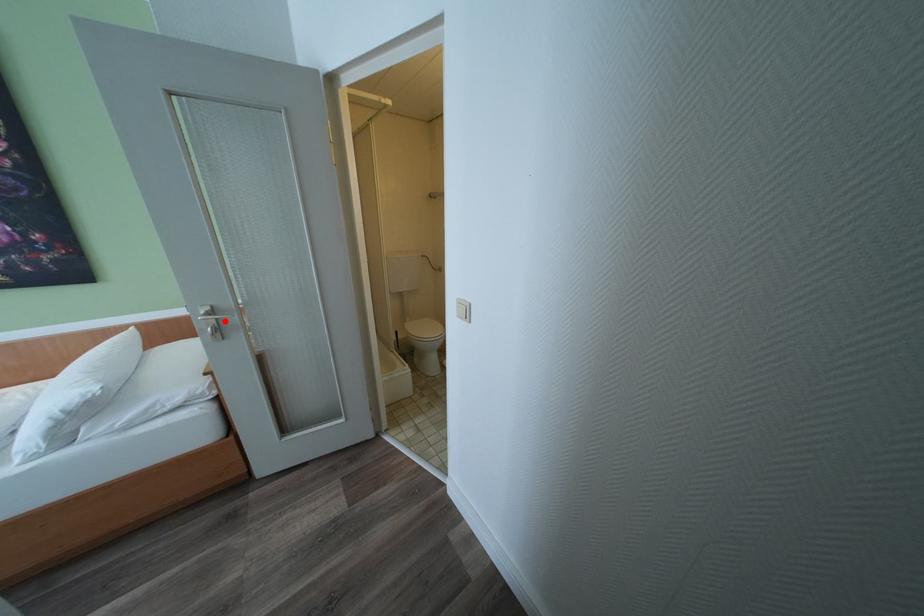
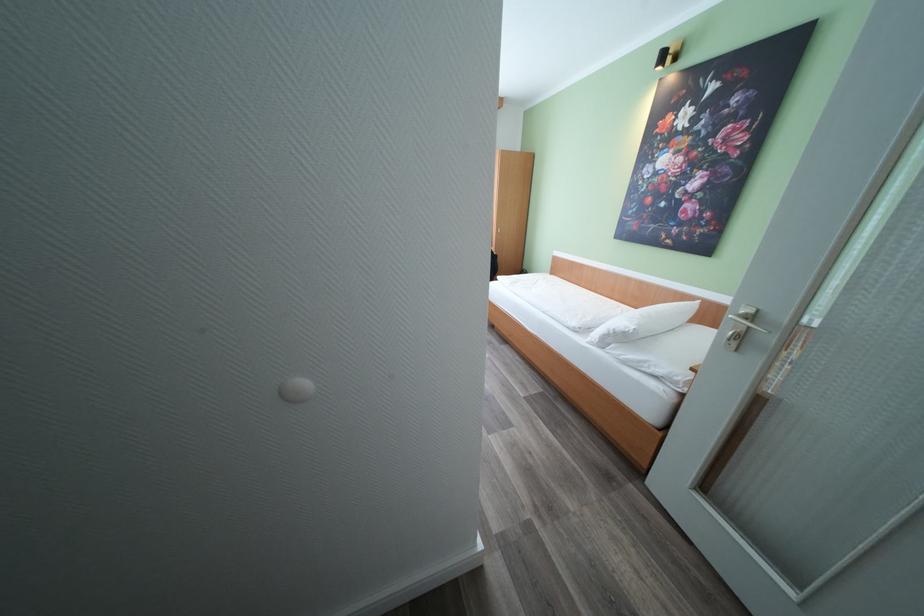
Question: I am providing you with two images of the same scene from different viewpoints. Image1 has a red point marked. In image2, the corresponding 3D location appears at what relative position? Reply with the corresponding letter.

Choices:
 (A) Closer
 (B) Farther

Answer: (B)